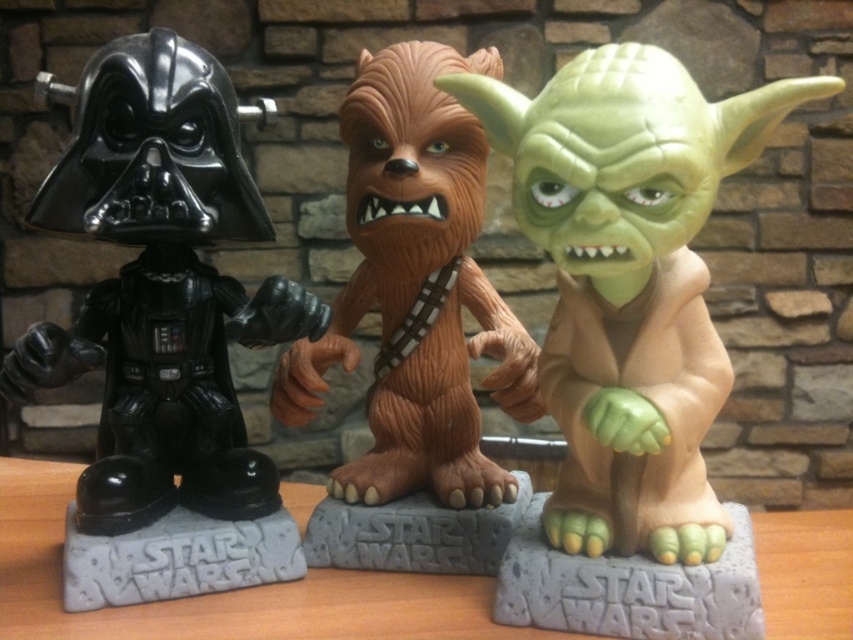
Question: Can you confirm if matte black helmet at left is positioned below green matte yoda at center?

Choices:
 (A) yes
 (B) no

Answer: (B)

Question: Does matte black helmet at left have a greater width compared to green matte yoda at center?

Choices:
 (A) yes
 (B) no

Answer: (A)

Question: Which object appears farthest from the camera in this image?

Choices:
 (A) brown textured fur at center
 (B) matte black helmet at left
 (C) green matte yoda at center

Answer: (A)

Question: Which of these objects is positioned closest to the green matte yoda at center?

Choices:
 (A) brown textured fur at center
 (B) matte black helmet at left

Answer: (A)

Question: Does matte black helmet at left have a smaller size compared to brown textured fur at center?

Choices:
 (A) no
 (B) yes

Answer: (A)

Question: Which of the following is the farthest from the observer?

Choices:
 (A) (461, 436)
 (B) (608, 387)
 (C) (119, 557)

Answer: (A)